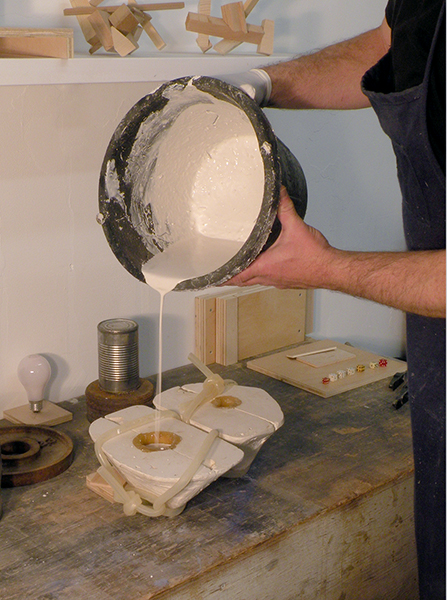
You are a GUI agent. You are given a task and a screenshot of the screen. Output one action in this format:
    pyautogui.click(x=<x>, y=<y>)
    Task: Click on the light bulb
    The height and width of the screenshot is (600, 447).
    Given the screenshot: What is the action you would take?
    coord(36,375)